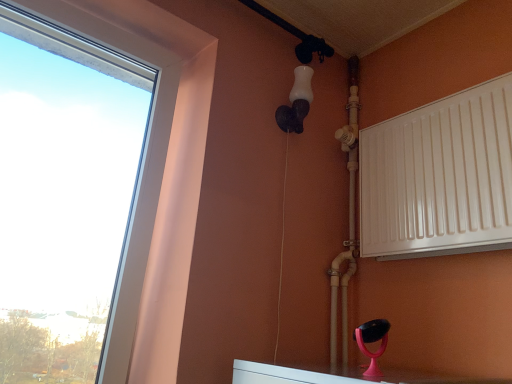
Question: Does white plastic window at left have a larger size compared to white glossy pipe at upper right?

Choices:
 (A) yes
 (B) no

Answer: (A)

Question: Considering the relative positions of white plastic window at left and white glossy pipe at upper right in the image provided, is white plastic window at left to the right of white glossy pipe at upper right from the viewer's perspective?

Choices:
 (A) yes
 (B) no

Answer: (B)

Question: Would you consider white plastic window at left to be distant from white glossy pipe at upper right?

Choices:
 (A) no
 (B) yes

Answer: (A)

Question: From the image's perspective, is white plastic window at left over white glossy pipe at upper right?

Choices:
 (A) yes
 (B) no

Answer: (A)

Question: Considering the relative positions of white plastic window at left and white glossy pipe at upper right in the image provided, is white plastic window at left in front of white glossy pipe at upper right?

Choices:
 (A) no
 (B) yes

Answer: (B)

Question: Can you confirm if white plastic window at left is thinner than white glossy pipe at upper right?

Choices:
 (A) no
 (B) yes

Answer: (A)

Question: Is white matte light fixture at upper center facing away from white plastic window at left?

Choices:
 (A) yes
 (B) no

Answer: (B)

Question: From the image's perspective, is white matte light fixture at upper center below white plastic window at left?

Choices:
 (A) yes
 (B) no

Answer: (B)

Question: Is the surface of white matte light fixture at upper center in direct contact with white plastic window at left?

Choices:
 (A) yes
 (B) no

Answer: (B)

Question: Does white matte light fixture at upper center have a greater height compared to white plastic window at left?

Choices:
 (A) yes
 (B) no

Answer: (B)

Question: Does white matte light fixture at upper center have a lesser width compared to white plastic window at left?

Choices:
 (A) no
 (B) yes

Answer: (B)

Question: From the image's perspective, is white matte light fixture at upper center over white plastic window at left?

Choices:
 (A) no
 (B) yes

Answer: (B)

Question: Is white matte light fixture at upper center bigger than white glossy pipe at upper right?

Choices:
 (A) no
 (B) yes

Answer: (A)